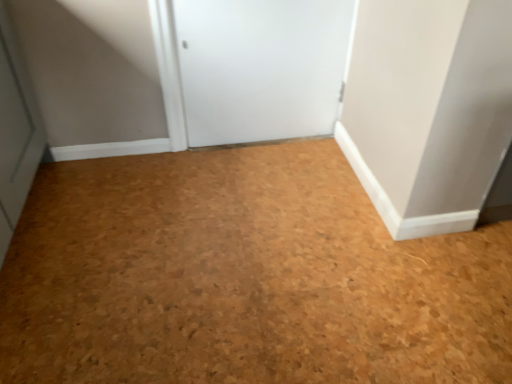
The image size is (512, 384). What are the coordinates of `cork floor at center` in the screenshot? It's located at (243, 278).

What do you see at coordinates (243, 278) in the screenshot?
I see `cork floor at center` at bounding box center [243, 278].

Image resolution: width=512 pixels, height=384 pixels. What do you see at coordinates (261, 67) in the screenshot?
I see `white matte door at center` at bounding box center [261, 67].

You are a GUI agent. You are given a task and a screenshot of the screen. Output one action in this format:
    pyautogui.click(x=<x>, y=<y>)
    Task: Click on the white matte door at center
    This screenshot has width=512, height=384.
    Given the screenshot: What is the action you would take?
    pyautogui.click(x=261, y=67)

Locate an element on the screen. cork floor at center is located at coordinates (243, 278).

Considering the positions of objects cork floor at center and white matte door at center in the image provided, who is more to the right, cork floor at center or white matte door at center?

cork floor at center.

In the image, is cork floor at center positioned in front of or behind white matte door at center?

cork floor at center is positioned closer to the viewer than white matte door at center.

Considering the points (124, 229) and (269, 0), which point is in front, point (124, 229) or point (269, 0)?

The point (124, 229) is in front.

From the image's perspective, between cork floor at center and white matte door at center, which one is located above?

white matte door at center.

From a real-world perspective, is cork floor at center located beneath white matte door at center?

Yes, from a real-world perspective, cork floor at center is under white matte door at center.

Between cork floor at center and white matte door at center, which one has smaller width?

white matte door at center.

Between cork floor at center and white matte door at center, which one has less height?

Standing shorter between the two is cork floor at center.

Which of these two, cork floor at center or white matte door at center, is bigger?

cork floor at center is bigger.

Is white matte door at center inside cork floor at center?

That's incorrect, white matte door at center is not inside cork floor at center.

Is cork floor at center beside white matte door at center?

No, cork floor at center is not with white matte door at center.

Is cork floor at center oriented away from white matte door at center?

No, white matte door at center is not at the back of cork floor at center.

What's the angular difference between cork floor at center and white matte door at center's facing directions?

The angle between the facing direction of cork floor at center and the facing direction of white matte door at center is 91.1 degrees.

Image resolution: width=512 pixels, height=384 pixels. In order to click on door located behind the cork floor at center in this screenshot , I will do `click(261, 67)`.

Can you confirm if white matte door at center is positioned to the left of cork floor at center?

Yes.

Which object is more forward, white matte door at center or cork floor at center?

cork floor at center is closer to the camera.

Which is closer to the camera, (x=277, y=122) or (x=276, y=285)?

Point (x=277, y=122).

From the image's perspective, is white matte door at center beneath cork floor at center?

Actually, white matte door at center appears above cork floor at center in the image.

From the picture: From a real-world perspective, which is physically above, white matte door at center or cork floor at center?

white matte door at center.

Which of these two, white matte door at center or cork floor at center, is thinner?

Thinner between the two is white matte door at center.

Considering the sizes of white matte door at center and cork floor at center in the image, is white matte door at center taller or shorter than cork floor at center?

In the image, white matte door at center appears to be taller than cork floor at center.

Who is bigger, white matte door at center or cork floor at center?

Bigger between the two is cork floor at center.

Would you say white matte door at center is inside or outside cork floor at center?

white matte door at center is outside cork floor at center.

Is white matte door at center not close to cork floor at center?

No, white matte door at center is in close proximity to cork floor at center.

Based on the photo, could you tell me if white matte door at center is facing cork floor at center?

Yes, white matte door at center is oriented towards cork floor at center.

What's the angular difference between white matte door at center and cork floor at center's facing directions?

91.1 degrees.

In order to click on plain in front of the white matte door at center in this screenshot , I will do `click(243, 278)`.

Locate an element on the screen. Image resolution: width=512 pixels, height=384 pixels. plain on the right of the white matte door at center is located at coordinates (243, 278).

Identify the location of door above the cork floor at center (from the image's perspective). (261, 67).